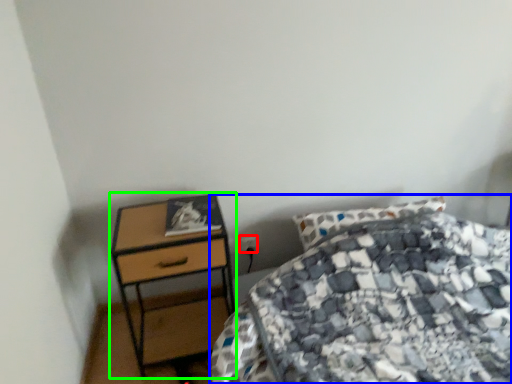
Question: Estimate the real-world distances between objects in this image. Which object is farther from power plugs and sockets (highlighted by a red box), bed (highlighted by a blue box) or nightstand (highlighted by a green box)?

Choices:
 (A) bed
 (B) nightstand

Answer: (A)